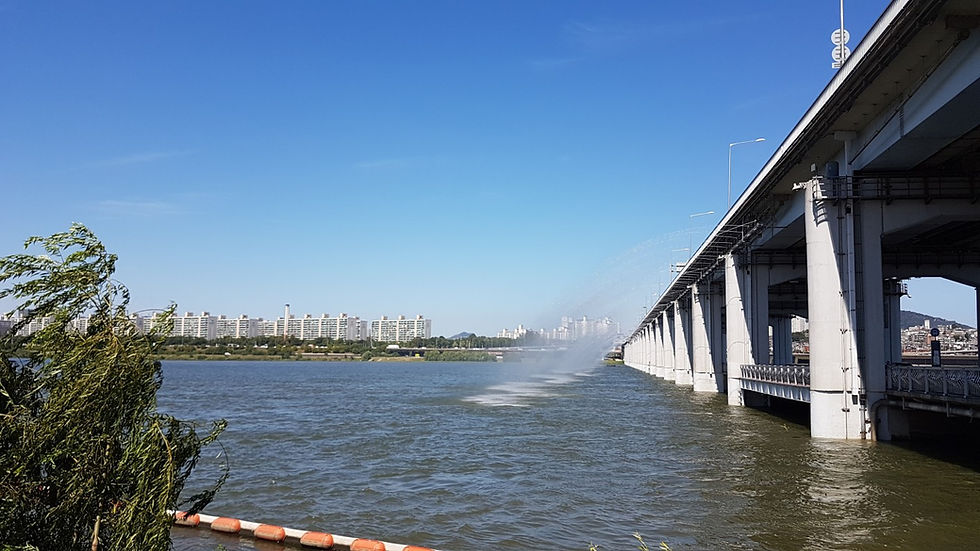
Where is `hotels`? hotels is located at coordinates (172, 320), (254, 317), (346, 322), (372, 329), (421, 329).